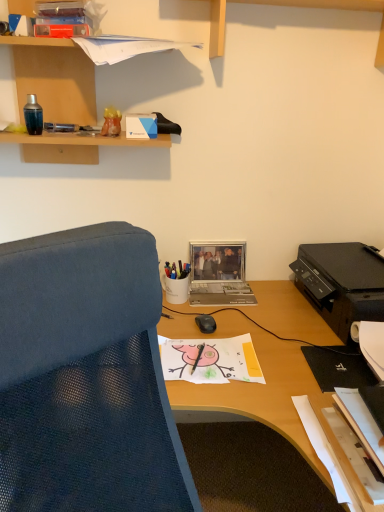
The image size is (384, 512). Describe the element at coordinates (176, 282) in the screenshot. I see `white glossy pen holder at center, the 2th stationery positioned from the top` at that location.

This screenshot has height=512, width=384. What do you see at coordinates (61, 127) in the screenshot?
I see `metallic pen at upper left, marked as the first pen in a top-to-bottom arrangement` at bounding box center [61, 127].

The height and width of the screenshot is (512, 384). Describe the element at coordinates (219, 275) in the screenshot. I see `metallic silver laptop at center` at that location.

The image size is (384, 512). I want to click on metallic silver laptop at center, so [x=219, y=275].

This screenshot has height=512, width=384. Describe the element at coordinates (198, 357) in the screenshot. I see `black matte pen at center, the second pen in the back-to-front sequence` at that location.

Locate an element on the screen. The image size is (384, 512). translucent orange vase at upper left, positioned as the 2th stationery in right-to-left order is located at coordinates (111, 122).

From a real-world perspective, is white glossy pen holder at center, the 2th stationery positioned from the top, on top of metallic silver laptop at center?

Indeed, from a real-world perspective, white glossy pen holder at center, the 2th stationery positioned from the top, stands above metallic silver laptop at center.

Which is more to the left, white glossy pen holder at center, the second stationery when ordered from left to right, or metallic silver laptop at center?

white glossy pen holder at center, the second stationery when ordered from left to right, is more to the left.

Considering the relative sizes of white glossy pen holder at center, the 2th stationery positioned from the top, and metallic silver laptop at center in the image provided, is white glossy pen holder at center, the 2th stationery positioned from the top, shorter than metallic silver laptop at center?

Yes.

Considering the relative sizes of white glossy pen holder at center, the second stationery when ordered from left to right, and metallic silver laptop at center in the image provided, is white glossy pen holder at center, the second stationery when ordered from left to right, bigger than metallic silver laptop at center?

Yes.

Is white glossy pen holder at center, the second stationery when ordered from left to right, inside wooden shelf at upper left?

Definitely not — white glossy pen holder at center, the second stationery when ordered from left to right, is not inside wooden shelf at upper left.

Which object is wider, wooden shelf at upper left or white glossy pen holder at center, which is counted as the 1th stationery, starting from the bottom?

Wider between the two is wooden shelf at upper left.

Between wooden shelf at upper left and white glossy pen holder at center, the second stationery when ordered from left to right, which one is positioned behind?

Positioned behind is white glossy pen holder at center, the second stationery when ordered from left to right.

Measure the distance between wooden shelf at upper left and white glossy pen holder at center, the second stationery when ordered from left to right.

wooden shelf at upper left is 25.34 inches from white glossy pen holder at center, the second stationery when ordered from left to right.

Is wooden shelf at upper left inside or outside of black matte pen at center, the second pen in the back-to-front sequence?

wooden shelf at upper left is not enclosed by black matte pen at center, the second pen in the back-to-front sequence.

Consider the image. Is wooden shelf at upper left positioned with its back to black matte pen at center, arranged as the 2th pen when viewed from the top?

That's not correct — wooden shelf at upper left is not looking away from black matte pen at center, arranged as the 2th pen when viewed from the top.

From the image's perspective, does wooden shelf at upper left appear lower than black matte pen at center, the second pen in the back-to-front sequence?

No, from the image's perspective, wooden shelf at upper left is not beneath black matte pen at center, the second pen in the back-to-front sequence.

Between wooden shelf at upper left and black matte pen at center, marked as the 1th pen in a front-to-back arrangement, which one appears on the right side from the viewer's perspective?

From the viewer's perspective, black matte pen at center, marked as the 1th pen in a front-to-back arrangement, appears more on the right side.

From the image's perspective, is wooden shelf at upper left located above or below metallic silver laptop at center?

wooden shelf at upper left is above metallic silver laptop at center.

Considering the sizes of wooden shelf at upper left and metallic silver laptop at center in the image, is wooden shelf at upper left taller or shorter than metallic silver laptop at center?

wooden shelf at upper left is taller than metallic silver laptop at center.

Which is more to the left, wooden shelf at upper left or metallic silver laptop at center?

wooden shelf at upper left.

In the scene shown: Who is bigger, wooden shelf at upper left or metallic silver laptop at center?

With larger size is wooden shelf at upper left.

How different are the orientations of white glossy pen holder at center, which is counted as the 1th stationery, starting from the bottom, and metallic pen at upper left, the second pen from the front, in degrees?

There is a 1.43-degree angle between the facing directions of white glossy pen holder at center, which is counted as the 1th stationery, starting from the bottom, and metallic pen at upper left, the second pen from the front.

From the picture: Between white glossy pen holder at center, the second stationery when ordered from left to right, and metallic pen at upper left, the second pen from the bottom, which one has smaller size?

metallic pen at upper left, the second pen from the bottom.

Could you tell me if white glossy pen holder at center, the 2th stationery positioned from the top, is facing metallic pen at upper left, marked as the first pen in a top-to-bottom arrangement?

No, white glossy pen holder at center, the 2th stationery positioned from the top, is not turned towards metallic pen at upper left, marked as the first pen in a top-to-bottom arrangement.

Considering their positions, is metallic pen at upper left, marked as the first pen in a top-to-bottom arrangement, located in front of or behind white glossy pen holder at center, the first stationery in the back-to-front sequence?

metallic pen at upper left, marked as the first pen in a top-to-bottom arrangement, is positioned closer to the viewer than white glossy pen holder at center, the first stationery in the back-to-front sequence.

Is point (78, 127) farther from viewer compared to point (165, 264)?

No, it is not.

Where is `the 2nd stationery to the right of the metallic pen at upper left, the second pen from the front, counting from the anchor's position`? This screenshot has width=384, height=512. the 2nd stationery to the right of the metallic pen at upper left, the second pen from the front, counting from the anchor's position is located at coordinates (176, 282).

Does metallic pen at upper left, which is the first pen from back to front, have a larger size compared to white glossy pen holder at center, the first stationery in the back-to-front sequence?

Actually, metallic pen at upper left, which is the first pen from back to front, might be smaller than white glossy pen holder at center, the first stationery in the back-to-front sequence.

Between wooden shelf at upper left and metallic pen at upper left, which is the first pen from back to front, which one has more height?

wooden shelf at upper left.

Can you confirm if wooden shelf at upper left is positioned to the right of metallic pen at upper left, positioned as the first pen in left-to-right order?

Indeed, wooden shelf at upper left is positioned on the right side of metallic pen at upper left, positioned as the first pen in left-to-right order.

Considering their positions, is wooden shelf at upper left located in front of or behind metallic pen at upper left, the second pen from the bottom?

wooden shelf at upper left is in front of metallic pen at upper left, the second pen from the bottom.

Which point is more distant from viewer, (x=17, y=38) or (x=58, y=131)?

The point (x=58, y=131) is farther.

This screenshot has width=384, height=512. In order to click on stationery that is the 1st one above the metallic silver laptop at center (from a real-world perspective) in this screenshot , I will do `click(176, 282)`.

The image size is (384, 512). I want to click on stationery that is the 2nd one below the wooden shelf at upper left (from a real-world perspective), so click(x=176, y=282).

Considering their positions, is black plastic printer at right positioned further to white glossy pen holder at center, the second stationery when ordered from left to right, than metallic silver laptop at center?

black plastic printer at right is positioned further to the anchor white glossy pen holder at center, the second stationery when ordered from left to right.

When comparing their distances from black plastic printer at right, does metallic silver laptop at center or metallic pen at upper left, which is the first pen from back to front, seem closer?

Among the two, metallic silver laptop at center is located nearer to black plastic printer at right.

Based on their spatial positions, is black matte pen at center, arranged as the 2th pen when viewed from the top, or black plastic printer at right closer to metallic silver laptop at center?

black plastic printer at right.

When comparing their distances from wooden shelf at upper left, does black plastic printer at right or metallic pen at upper left, the second pen from the bottom, seem further?

black plastic printer at right is positioned further to the anchor wooden shelf at upper left.

From the image, which object appears to be farther from black matte pen at center, arranged as the 2th pen when viewed from the top, metallic silver laptop at center or black plastic printer at right?

Based on the image, black plastic printer at right appears to be further to black matte pen at center, arranged as the 2th pen when viewed from the top.

Estimate the real-world distances between objects in this image. Which object is further from black matte pen at center, arranged as the 2th pen when viewed from the top, wooden shelf at upper left or metallic silver laptop at center?

wooden shelf at upper left.

Estimate the real-world distances between objects in this image. Which object is further from wooden shelf at upper left, white glossy pen holder at center, the 2th stationery positioned from the top, or black plastic printer at right?

Based on the image, black plastic printer at right appears to be further to wooden shelf at upper left.

Considering their positions, is black matte pen at center, the second pen in the back-to-front sequence, positioned closer to metallic pen at upper left, the second pen from the bottom, than translucent orange vase at upper left, acting as the 1th stationery starting from the left?

translucent orange vase at upper left, acting as the 1th stationery starting from the left, is closer to metallic pen at upper left, the second pen from the bottom.

Where is `pen between translucent orange vase at upper left, which is the second stationery in back-to-front order, and black matte pen at center, which is the first pen in bottom-to-top order, in the vertical direction`? The image size is (384, 512). pen between translucent orange vase at upper left, which is the second stationery in back-to-front order, and black matte pen at center, which is the first pen in bottom-to-top order, in the vertical direction is located at coordinates (61, 127).

This screenshot has width=384, height=512. What are the coordinates of `laptop between translucent orange vase at upper left, positioned as the 2th stationery in right-to-left order, and black matte pen at center, the first pen from the right, in the vertical direction` in the screenshot? It's located at (219, 275).

Locate an element on the screen. This screenshot has height=512, width=384. stationery between translucent orange vase at upper left, placed as the first stationery when sorted from top to bottom, and black plastic printer at right is located at coordinates (176, 282).

The width and height of the screenshot is (384, 512). I want to click on stationery between wooden shelf at upper left and white glossy pen holder at center, the 2th stationery positioned from the top, vertically, so click(111, 122).